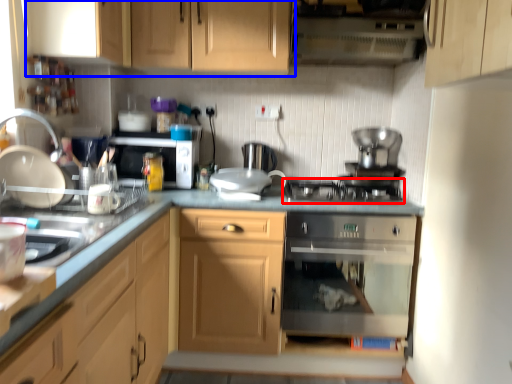
Question: Which object appears closest to the camera in this image, gas stove (highlighted by a red box) or cabinetry (highlighted by a blue box)?

Choices:
 (A) gas stove
 (B) cabinetry

Answer: (B)